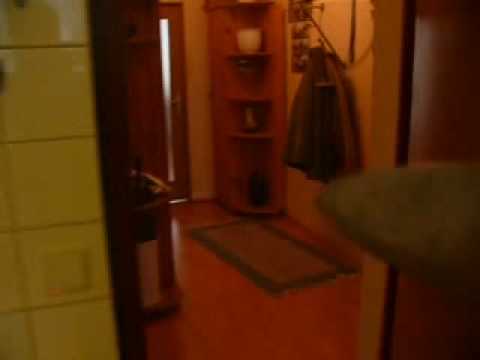
Identify the location of coat. (324, 125).